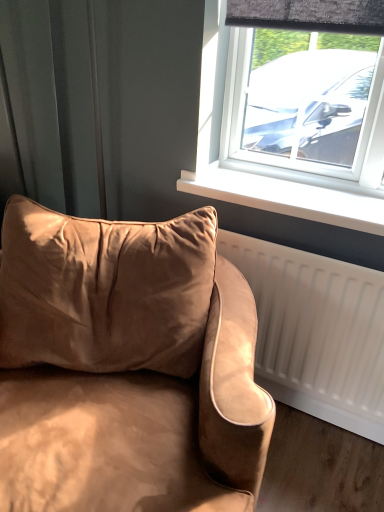
I want to click on free point above white plastic window sill at center (from a real-world perspective), so tap(284, 186).